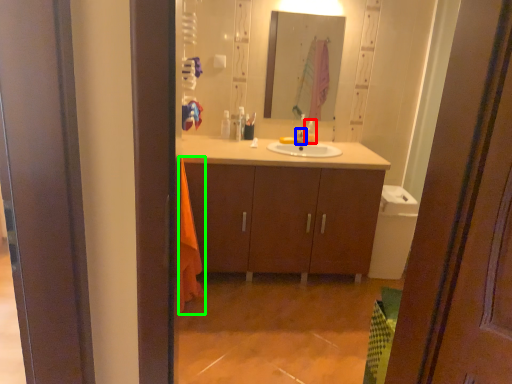
Question: Which object is positioned farthest from toiletry (highlighted by a red box)? Select from tap (highlighted by a blue box) and beach towel (highlighted by a green box).

Choices:
 (A) tap
 (B) beach towel

Answer: (B)